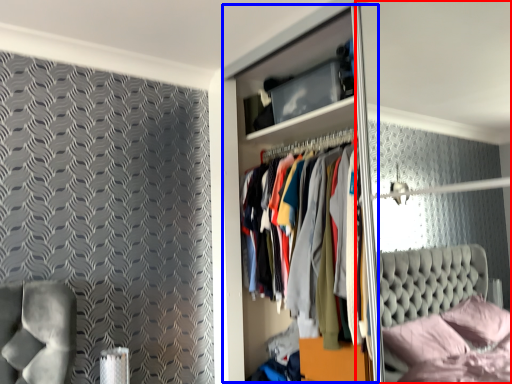
Question: Among these objects, which one is nearest to the camera, glass door (highlighted by a red box) or dresser (highlighted by a blue box)?

Choices:
 (A) glass door
 (B) dresser

Answer: (A)